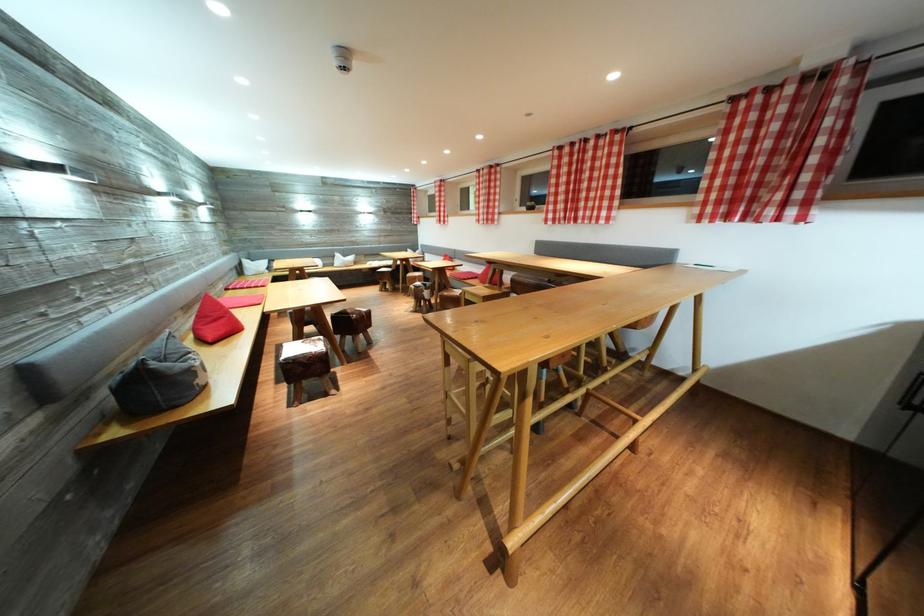
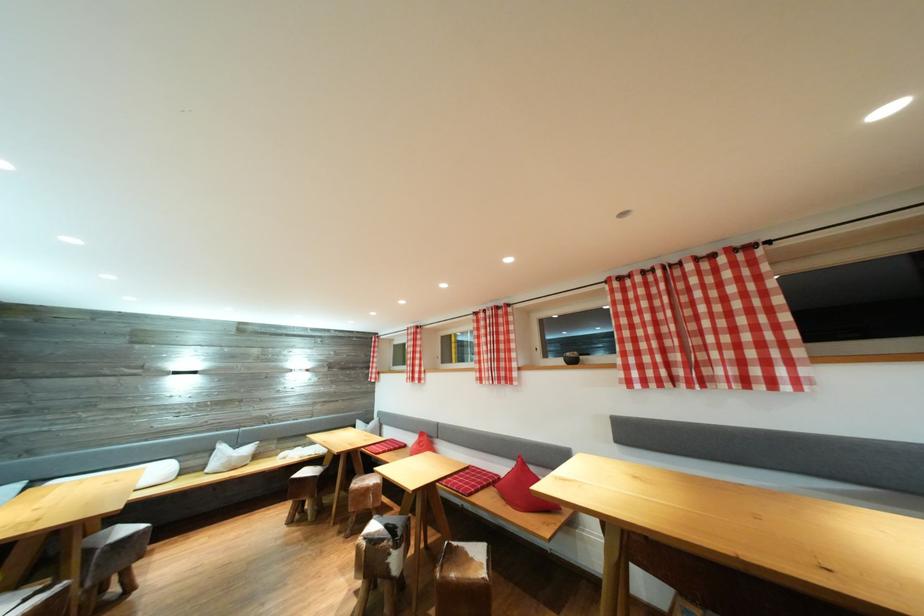
Locate, in the second image, the point that corresponds to [446,201] in the first image.

(421, 351)